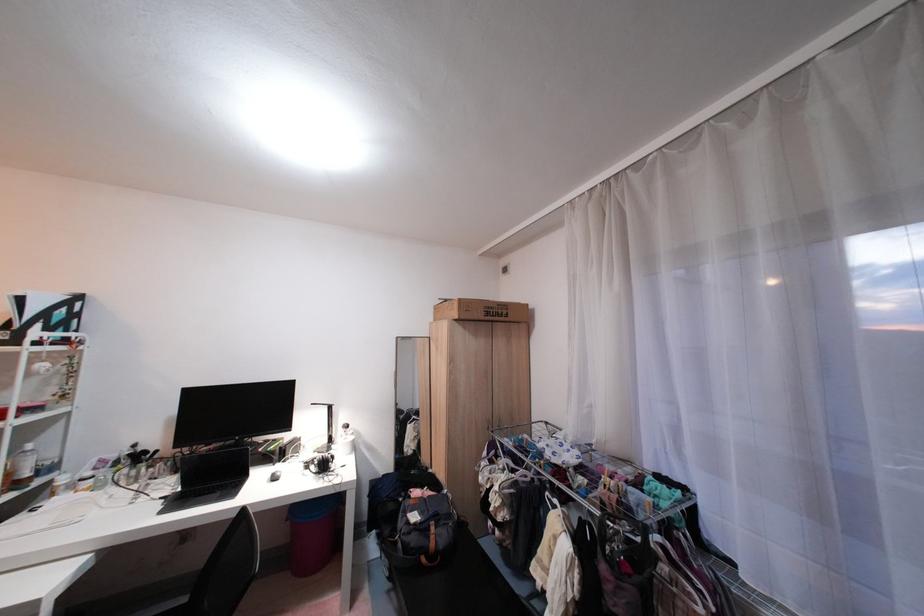
The image size is (924, 616). What do you see at coordinates (156, 606) in the screenshot?
I see `the chair sitting surface` at bounding box center [156, 606].